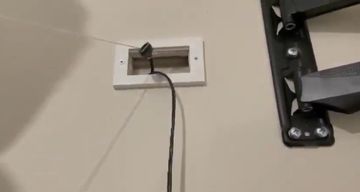
This screenshot has width=360, height=192. What are the coordinates of `black shelving bracket` in the screenshot? It's located at (306, 118).